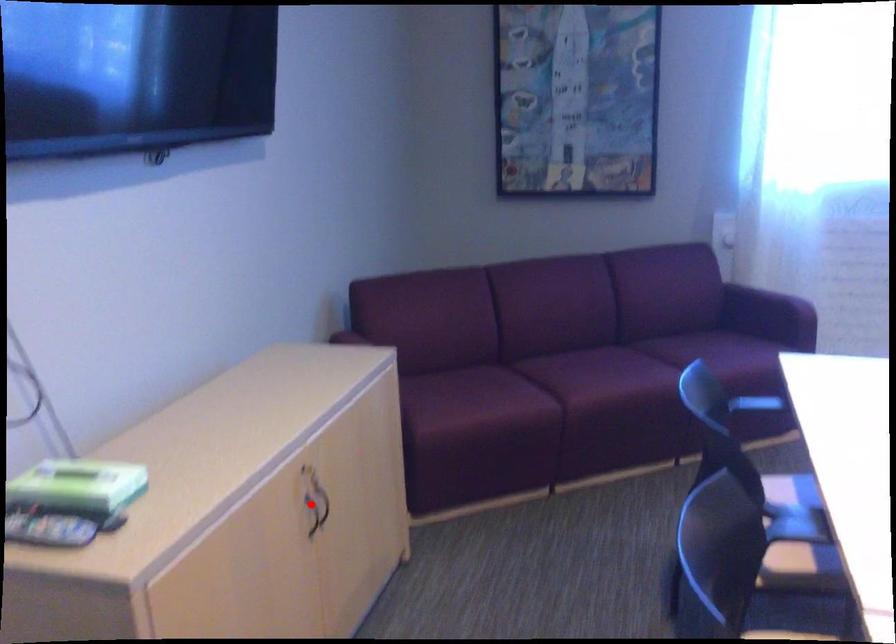
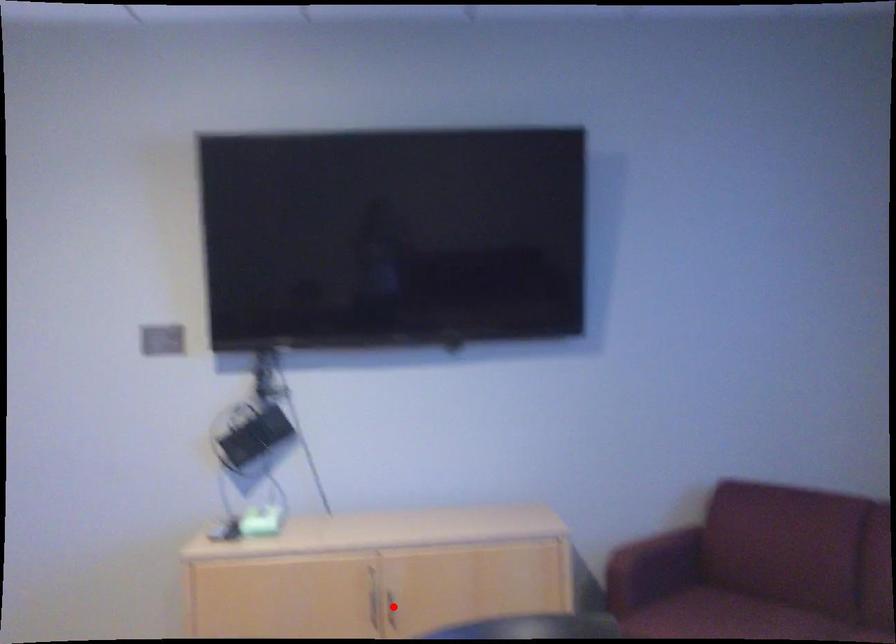
I am providing you with two images of the same scene from different viewpoints. A red point is marked on the first image and another point is marked on the second image. Is the marked point in image1 the same physical position as the marked point in image2?

Yes